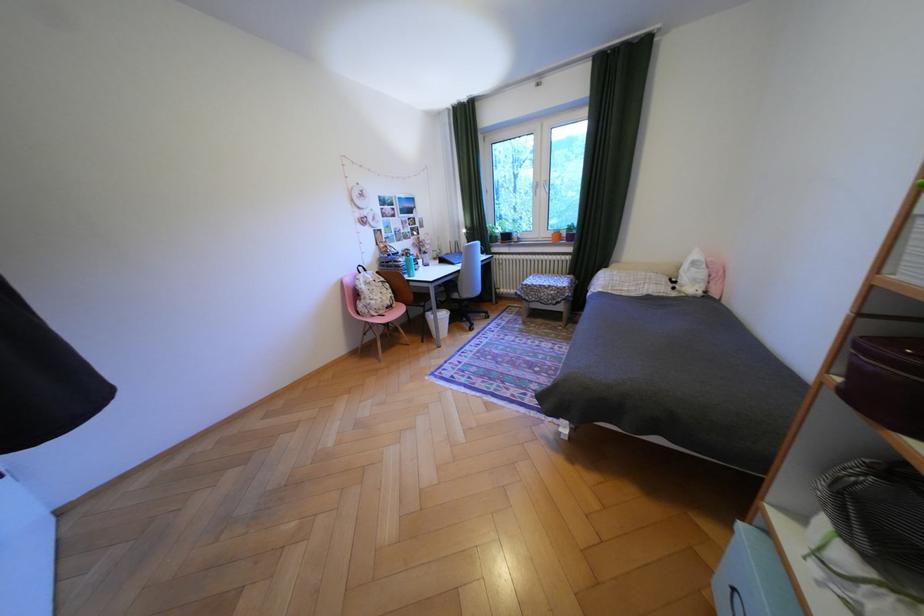
The width and height of the screenshot is (924, 616). Identify the location of blue chair armrest. (371, 315).